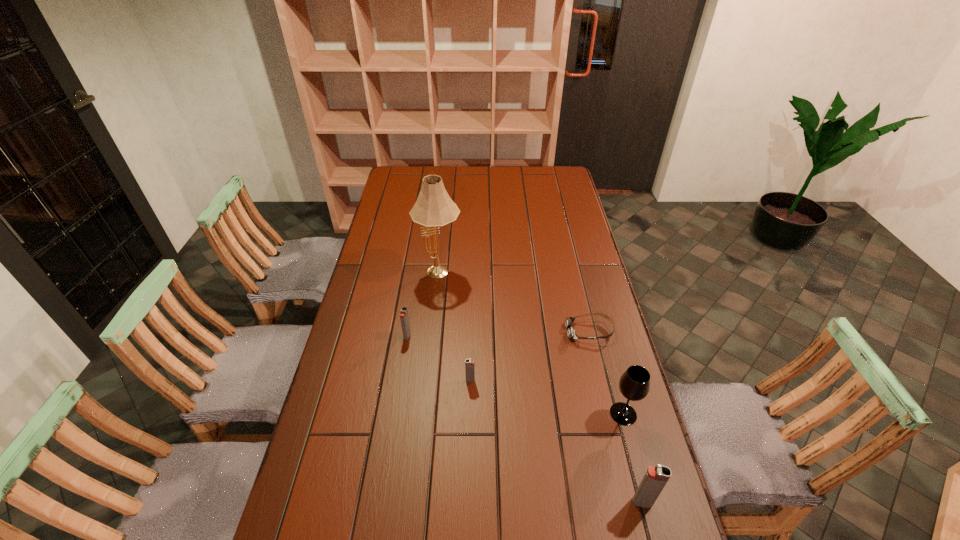
What are the coordinates of `igniter that stands as the closest to the second farthest igniter` in the screenshot? It's located at (404, 318).

Choose which igniter is the second nearest neighbor to the rightmost igniter. Please provide its 2D coordinates. Your answer should be formatted as a tuple, i.e. [(x, y)], where the tuple contains the x and y coordinates of a point satisfying the conditions above.

[(404, 318)]

At what (x,y) coordinates should I click in order to perform the action: click on free space that satisfies the following two spatial constraints: 1. on the front-facing side of the fifth farthest object; 2. on the left side of the goggles. Please return your answer as a coordinate pair (x, y). The image size is (960, 540). Looking at the image, I should click on (610, 414).

I want to click on free space that satisfies the following two spatial constraints: 1. on the front-facing side of the shortest object; 2. on the right side of the rightmost igniter, so click(631, 502).

Identify the location of vacant region that satisfies the following two spatial constraints: 1. on the front-facing side of the goggles; 2. on the right side of the rightmost igniter. (631, 502).